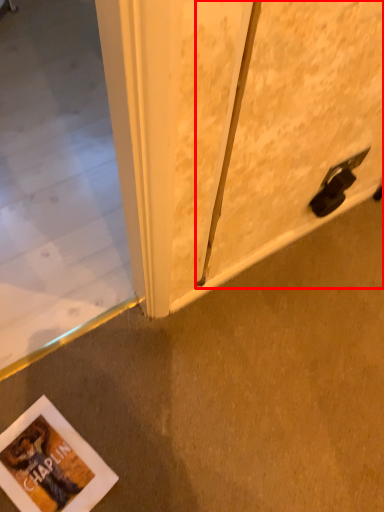
Question: From the image's perspective, what is the correct spatial positioning of screen door (annotated by the red box) in reference to concrete?

Choices:
 (A) above
 (B) below

Answer: (A)